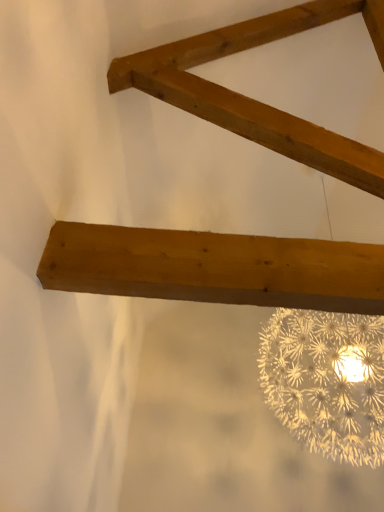
The image size is (384, 512). What do you see at coordinates (327, 381) in the screenshot? I see `white paper lampshade at lower right` at bounding box center [327, 381].

In order to click on white paper lampshade at lower right in this screenshot , I will do `click(327, 381)`.

Locate an element on the screen. This screenshot has width=384, height=512. white paper lampshade at lower right is located at coordinates (327, 381).